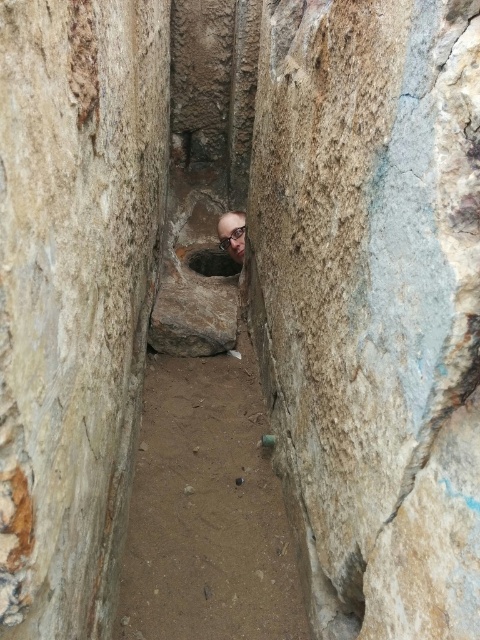
You are an archaeologist exploring the passage. You notice the smooth stone hole at center and the smooth bald head at center. Which object is positioned lower in the passage?

The smooth stone hole at center is located below the smooth bald head at center, so it is positioned lower in the passage.

From the picture: You are navigating through the ancient stone passage and need to place a marker at the point that is further away from the entrance. Which point should you choose between point (223,268) and point (241,227)?

Point (223,268) is behind point (241,227), so you should choose point (223,268) as it is further away from the entrance.